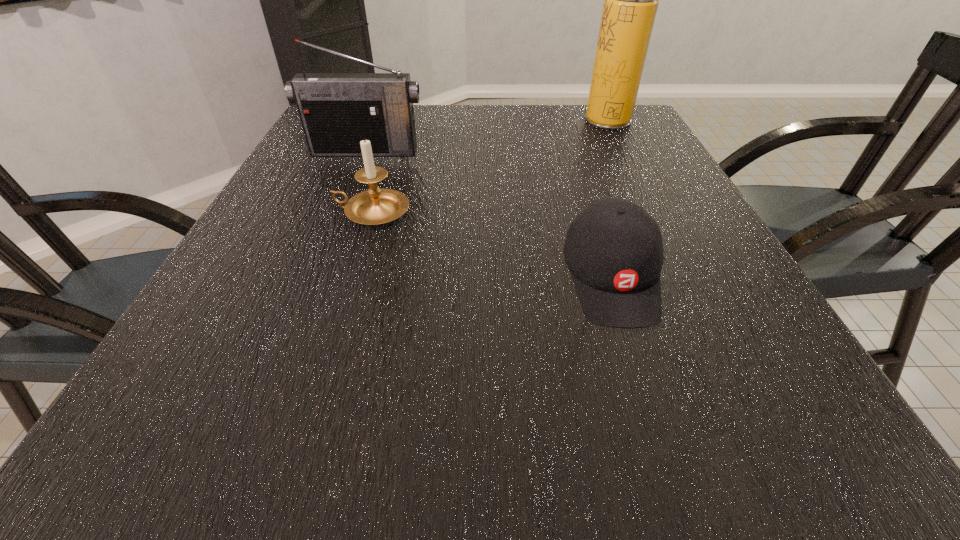
Where is `free region at the far edge of the desktop`? free region at the far edge of the desktop is located at coordinates (517, 122).

Image resolution: width=960 pixels, height=540 pixels. In the image, there is a desktop. What are the coordinates of `vacant area at the near edge` in the screenshot? It's located at (449, 461).

I want to click on vacant space at the left edge, so click(348, 161).

Where is `free location at the right edge`? This screenshot has width=960, height=540. free location at the right edge is located at coordinates (660, 180).

In the image, there is a desktop. Identify the location of free region at the near left corner. (137, 460).

Where is `free spot between the second shortest object and the farthest object`? This screenshot has width=960, height=540. free spot between the second shortest object and the farthest object is located at coordinates (491, 166).

Locate an element on the screen. The height and width of the screenshot is (540, 960). vacant space in between the third farthest object and the tallest object is located at coordinates (491, 166).

At what (x,y) coordinates should I click in order to perform the action: click on free spot between the baseball cap and the radio receiver. Please return your answer as a coordinate pair (x, y). This screenshot has width=960, height=540. Looking at the image, I should click on point(488,215).

Image resolution: width=960 pixels, height=540 pixels. What are the coordinates of `empty space that is in between the radio receiver and the nearest object` in the screenshot? It's located at (488, 215).

Identify the location of vacant area that lies between the third shortest object and the farthest object. (487, 135).